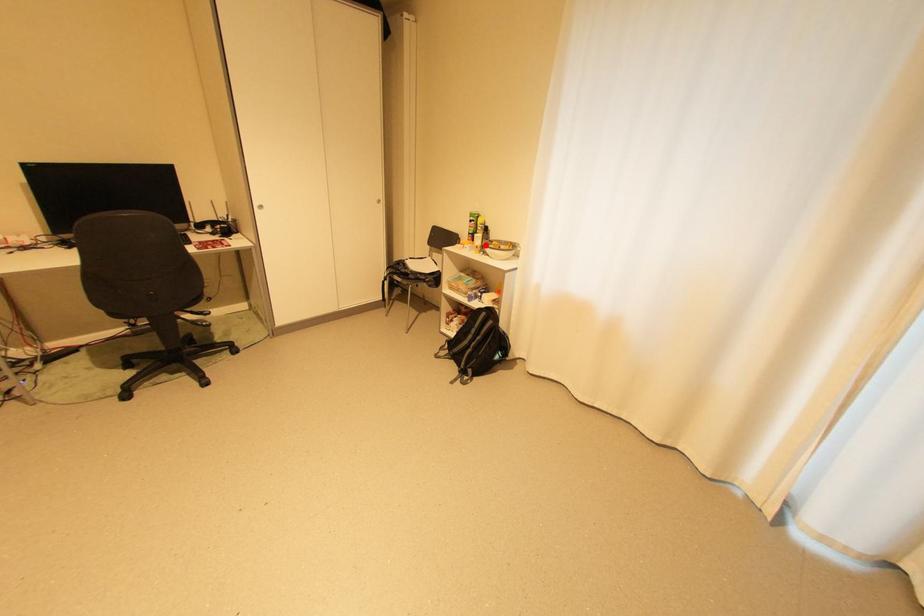
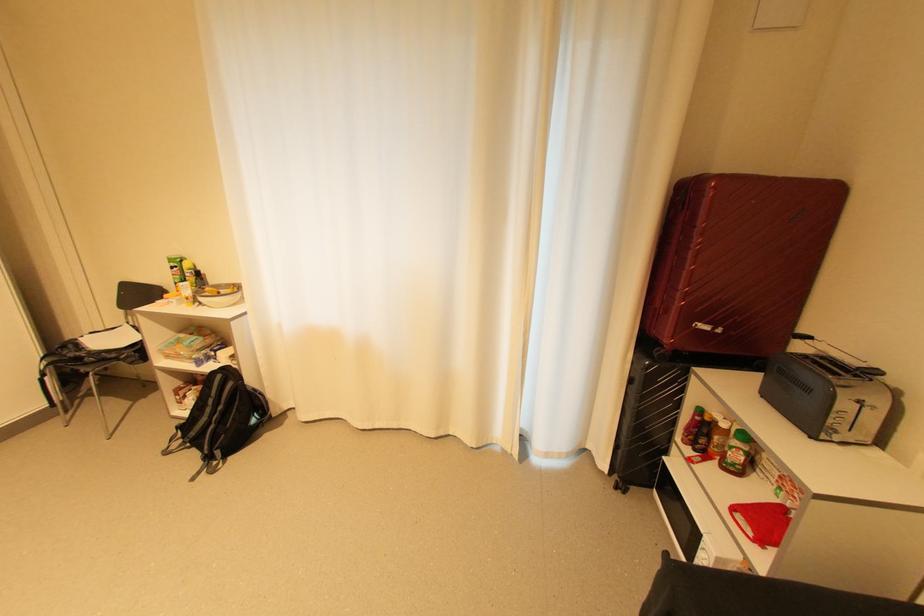
Find the pixel in the second image that matches the highlighted location in the first image.

(196, 296)